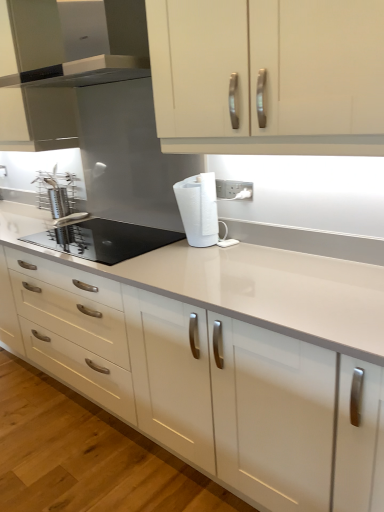
Question: Considering the relative sizes of matte white cabinet at upper center, which is counted as the first cabinetry, starting from the back, and white matte paper towel at center in the image provided, is matte white cabinet at upper center, which is counted as the first cabinetry, starting from the back, bigger than white matte paper towel at center?

Choices:
 (A) no
 (B) yes

Answer: (B)

Question: Does matte white cabinet at upper center, which appears as the first cabinetry when viewed from the left, touch white matte paper towel at center?

Choices:
 (A) yes
 (B) no

Answer: (B)

Question: Considering the relative sizes of matte white cabinet at upper center, which ranks as the 2th cabinetry in right-to-left order, and white matte paper towel at center in the image provided, is matte white cabinet at upper center, which ranks as the 2th cabinetry in right-to-left order, taller than white matte paper towel at center?

Choices:
 (A) yes
 (B) no

Answer: (A)

Question: From the image's perspective, is matte white cabinet at upper center, the second cabinetry in the front-to-back sequence, below white matte paper towel at center?

Choices:
 (A) no
 (B) yes

Answer: (A)

Question: Is matte white cabinet at upper center, which appears as the first cabinetry when viewed from the left, at the left side of white matte paper towel at center?

Choices:
 (A) yes
 (B) no

Answer: (A)

Question: In terms of width, does satin silver range hood at upper left look wider or thinner when compared to white matte paper towel at center?

Choices:
 (A) thin
 (B) wide

Answer: (B)

Question: From the image's perspective, relative to white matte paper towel at center, is satin silver range hood at upper left above or below?

Choices:
 (A) below
 (B) above

Answer: (B)

Question: Considering the positions of satin silver range hood at upper left and white matte paper towel at center in the image, is satin silver range hood at upper left taller or shorter than white matte paper towel at center?

Choices:
 (A) tall
 (B) short

Answer: (A)

Question: Looking at the image, does satin silver range hood at upper left seem bigger or smaller compared to white matte paper towel at center?

Choices:
 (A) small
 (B) big

Answer: (B)

Question: From a real-world perspective, is black glass cooktop at center-left physically located above or below matte white cabinet at upper center, which appears as the first cabinetry when viewed from the left?

Choices:
 (A) above
 (B) below

Answer: (B)

Question: In the image, is black glass cooktop at center-left positioned in front of or behind matte white cabinet at upper center, the second cabinetry in the front-to-back sequence?

Choices:
 (A) front
 (B) behind

Answer: (A)

Question: Choose the correct answer: Is black glass cooktop at center-left inside matte white cabinet at upper center, which appears as the first cabinetry when viewed from the left, or outside it?

Choices:
 (A) inside
 (B) outside

Answer: (B)

Question: Is point (97, 228) closer or farther from the camera than point (46, 110)?

Choices:
 (A) closer
 (B) farther

Answer: (A)

Question: Is white glossy cabinet doors at upper center, placed as the second cabinetry when sorted from back to front, bigger or smaller than satin silver range hood at upper left?

Choices:
 (A) small
 (B) big

Answer: (B)

Question: Is white glossy cabinet doors at upper center, which appears as the 1th cabinetry when viewed from the front, in front of or behind satin silver range hood at upper left in the image?

Choices:
 (A) behind
 (B) front

Answer: (B)